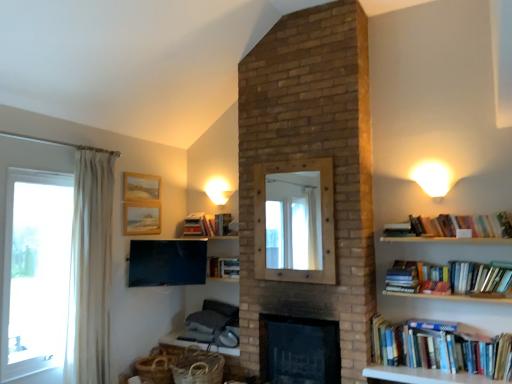
Question: From a real-world perspective, relative to wooden mirror at center, is white wood table at lower center vertically above or below?

Choices:
 (A) below
 (B) above

Answer: (A)

Question: In the image, is white wood table at lower center positioned in front of or behind wooden mirror at center?

Choices:
 (A) behind
 (B) front

Answer: (A)

Question: Which is nearer to the white fabric curtain at left?

Choices:
 (A) white wood table at lower center
 (B) white matte wall sconce at upper center, placed as the 1th light fixture when sorted from back to front
 (C) wooden textured picture frame at upper left, arranged as the 2th picture frame when viewed from the top
 (D) wooden picture frame at upper left, marked as the 1th picture frame in a top-to-bottom arrangement
 (E) black brick fireplace at center

Answer: (C)

Question: Which is nearer to the white fabric curtain at left?

Choices:
 (A) hardcover books at right, which ranks as the 4th book in left-to-right order
 (B) black brick fireplace at center
 (C) hardcover book at center, which is counted as the second book, starting from the bottom
 (D) wooden textured picture frame at upper left, arranged as the 2th picture frame when viewed from the top
 (E) matte black tv at upper left

Answer: (E)